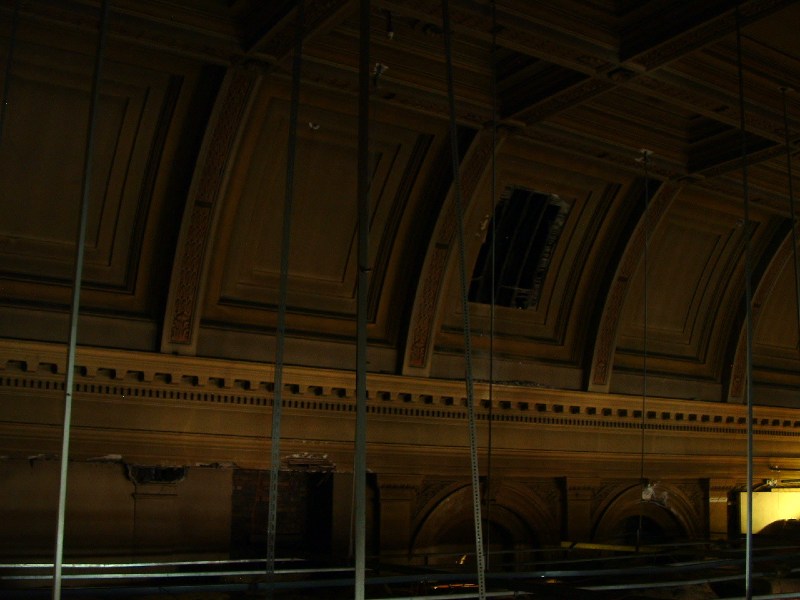
Identify the location of ceiling cross beam. This screenshot has height=600, width=800. (621, 71).